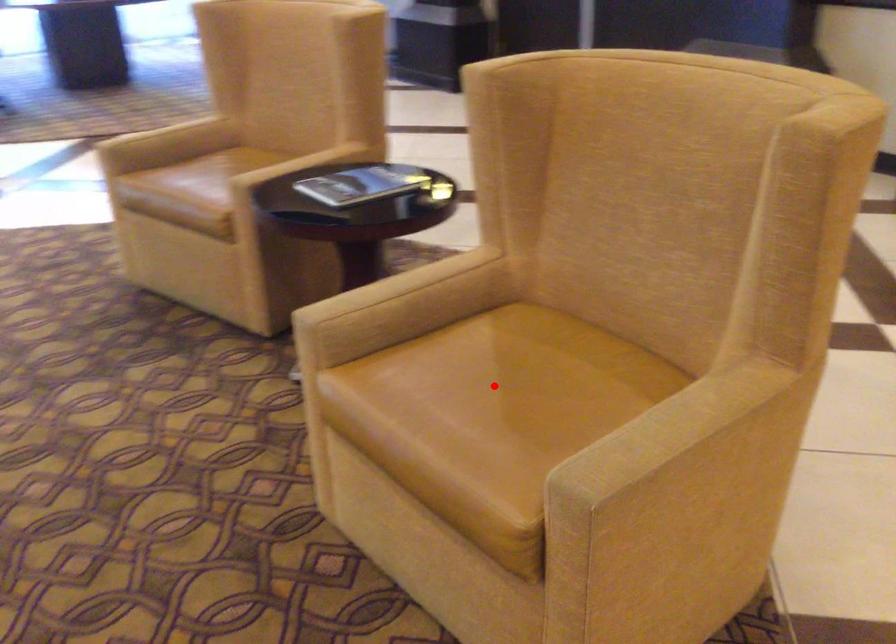
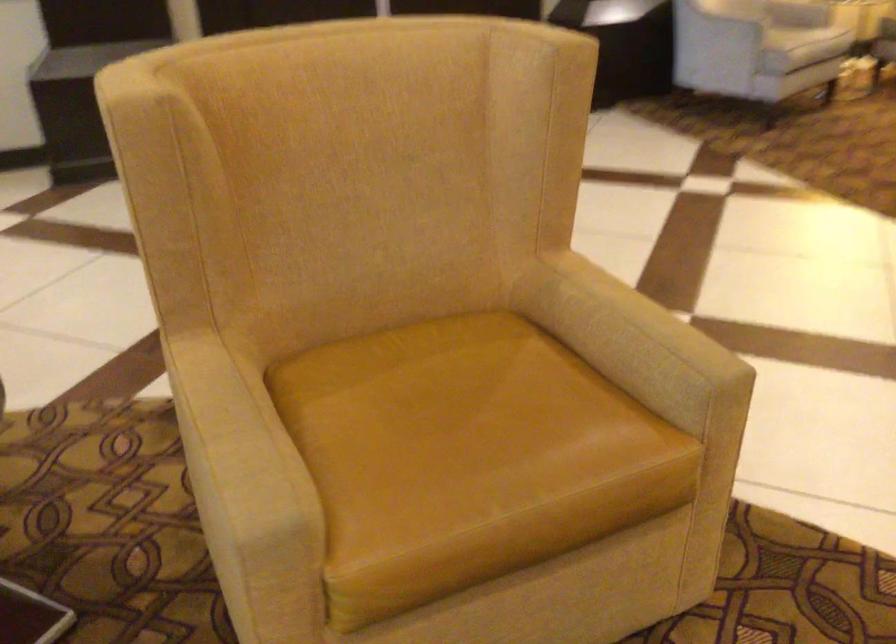
Question: A red point is marked in image1. In image2, is the corresponding 3D point closer to the camera or farther? Reply with the corresponding letter.

Choices:
 (A) The corresponding 3D point is closer.
 (B) The corresponding 3D point is farther.

Answer: (A)